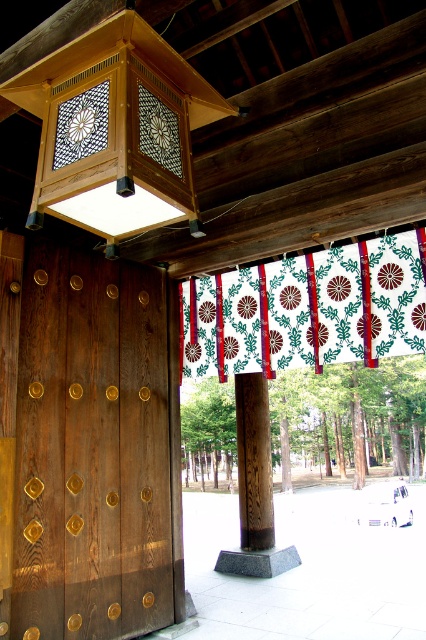
Does dark brown wood at center have a greater width compared to white fabric with floral pattern at center?

Incorrect, dark brown wood at center's width does not surpass white fabric with floral pattern at center's.

Does dark brown wood at center appear over white fabric with floral pattern at center?

Actually, dark brown wood at center is below white fabric with floral pattern at center.

What do you see at coordinates (92, 449) in the screenshot?
I see `dark brown wood at center` at bounding box center [92, 449].

The image size is (426, 640). Find the location of `dark brown wood at center`. dark brown wood at center is located at coordinates (92, 449).